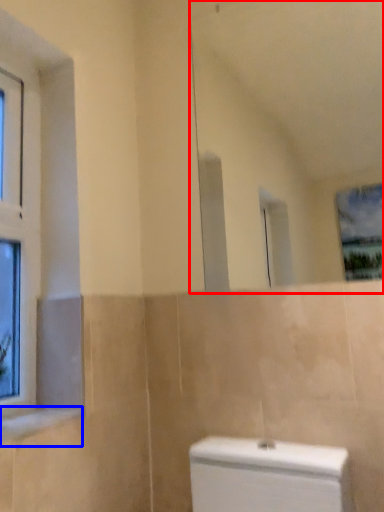
Question: Which object appears farthest to the camera in this image, mirror (highlighted by a red box) or window sill (highlighted by a blue box)?

Choices:
 (A) mirror
 (B) window sill

Answer: (A)